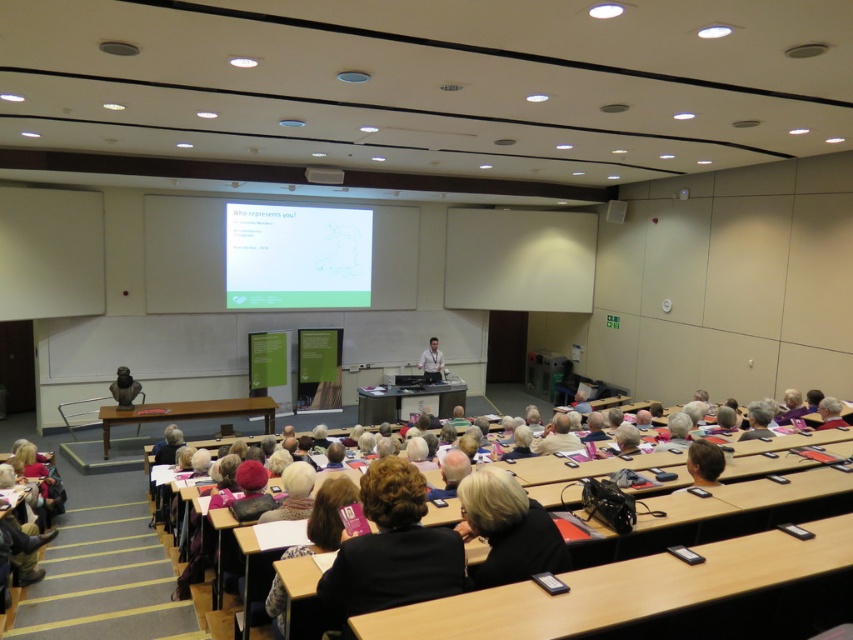
Does dark brown leather jacket at center have a larger size compared to smooth wooden desk at lower center?

Actually, dark brown leather jacket at center might be smaller than smooth wooden desk at lower center.

Is dark brown leather jacket at center wider than smooth wooden desk at lower center?

In fact, dark brown leather jacket at center might be narrower than smooth wooden desk at lower center.

The image size is (853, 640). I want to click on dark brown leather jacket at center, so click(x=392, y=548).

Does smooth wooden desk at lower center have a lesser width compared to matte bronze bust at lower left?

No, smooth wooden desk at lower center is not thinner than matte bronze bust at lower left.

Can you confirm if smooth wooden desk at lower center is wider than matte bronze bust at lower left?

Yes, smooth wooden desk at lower center is wider than matte bronze bust at lower left.

Where is `smooth wooden desk at lower center`? The height and width of the screenshot is (640, 853). smooth wooden desk at lower center is located at coordinates (724, 513).

Who is positioned more to the left, dark brown leather jacket at center or matte bronze bust at lower left?

Positioned to the left is matte bronze bust at lower left.

Identify the location of dark brown leather jacket at center. This screenshot has height=640, width=853. (392, 548).

Does point (339, 612) lie in front of point (131, 401)?

Yes, point (339, 612) is in front of point (131, 401).

Image resolution: width=853 pixels, height=640 pixels. I want to click on dark brown leather jacket at center, so click(392, 548).